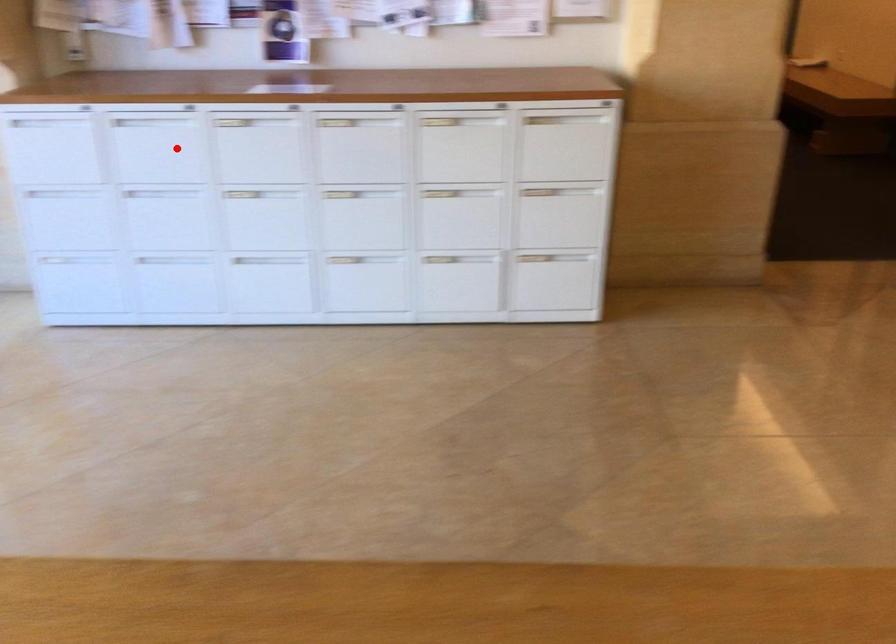
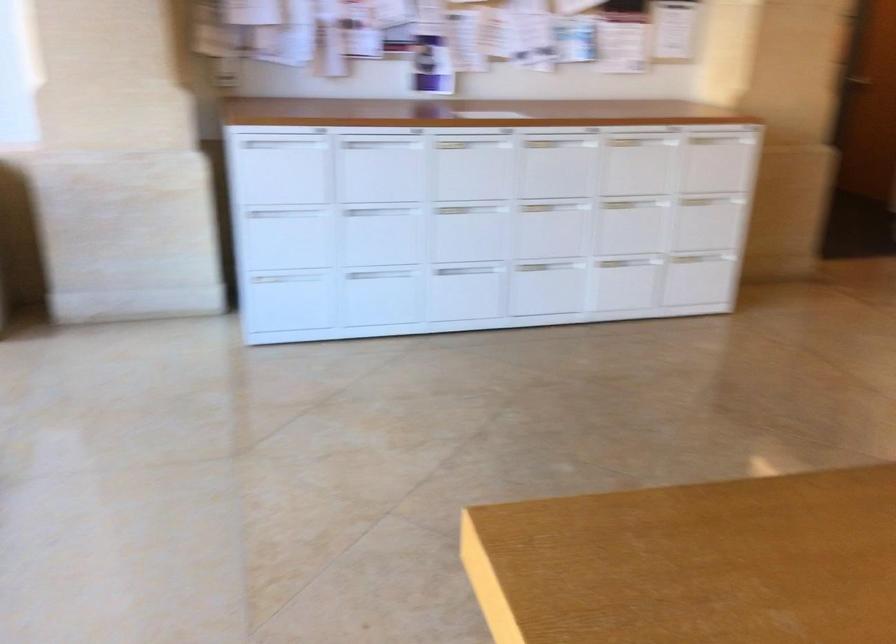
Locate, in the second image, the point that corresponds to the highlighted location in the first image.

(380, 167)